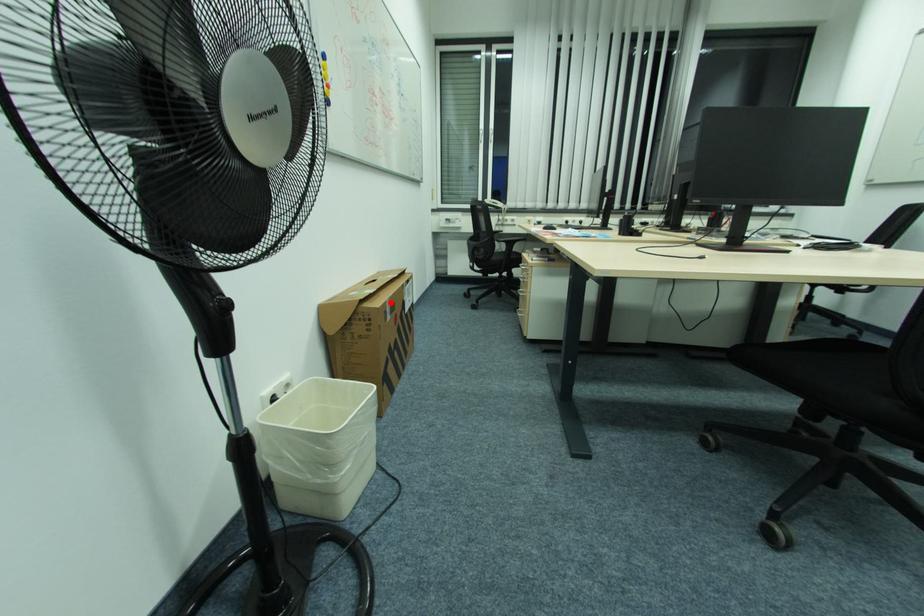
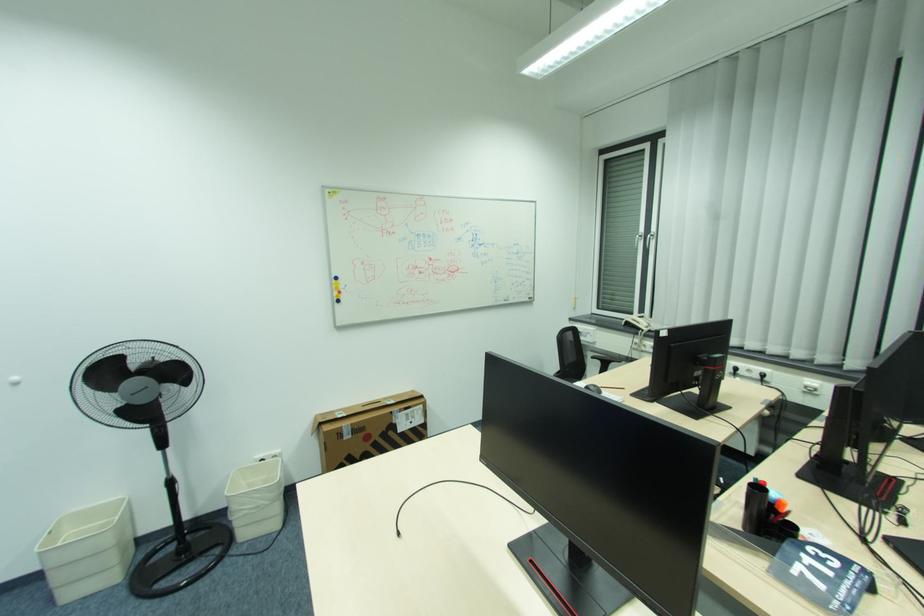
Locate, in the second image, the point that corresponds to the highlighted location in the first image.

(346, 427)